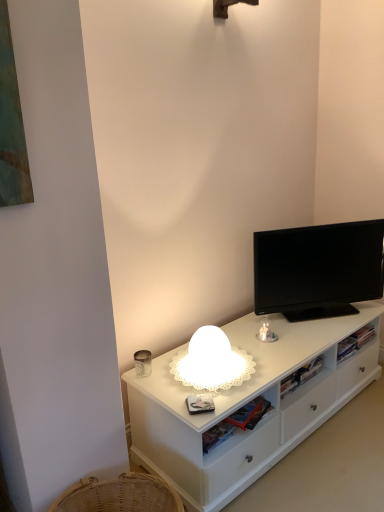
Question: Considering the relative sizes of black glossy tv at upper right and white matte cabinet at center in the image provided, is black glossy tv at upper right wider than white matte cabinet at center?

Choices:
 (A) yes
 (B) no

Answer: (B)

Question: Is black glossy tv at upper right surrounding white matte cabinet at center?

Choices:
 (A) yes
 (B) no

Answer: (B)

Question: Can you confirm if black glossy tv at upper right is positioned to the left of white matte cabinet at center?

Choices:
 (A) no
 (B) yes

Answer: (A)

Question: From the image's perspective, is black glossy tv at upper right over white matte cabinet at center?

Choices:
 (A) yes
 (B) no

Answer: (A)

Question: Does black glossy tv at upper right have a lesser width compared to white matte cabinet at center?

Choices:
 (A) yes
 (B) no

Answer: (A)

Question: Considering the relative positions of black glossy tv at upper right and white matte cabinet at center in the image provided, is black glossy tv at upper right to the left or to the right of white matte cabinet at center?

Choices:
 (A) right
 (B) left

Answer: (A)

Question: Is black glossy tv at upper right spatially inside white matte cabinet at center, or outside of it?

Choices:
 (A) inside
 (B) outside

Answer: (B)

Question: Is point (342, 268) positioned closer to the camera than point (236, 458)?

Choices:
 (A) farther
 (B) closer

Answer: (A)

Question: From a real-world perspective, is black glossy tv at upper right physically located above or below white matte cabinet at center?

Choices:
 (A) below
 (B) above

Answer: (B)

Question: From the image's perspective, relative to white matte cabinet at center, is white frosted glass lamp at center above or below?

Choices:
 (A) below
 (B) above

Answer: (B)

Question: In terms of size, does white frosted glass lamp at center appear bigger or smaller than white matte cabinet at center?

Choices:
 (A) small
 (B) big

Answer: (A)

Question: From their relative heights in the image, would you say white frosted glass lamp at center is taller or shorter than white matte cabinet at center?

Choices:
 (A) tall
 (B) short

Answer: (A)

Question: Is point (215, 379) closer or farther from the camera than point (256, 375)?

Choices:
 (A) farther
 (B) closer

Answer: (B)

Question: Is black glossy tv at upper right wider or thinner than white frosted glass lamp at center?

Choices:
 (A) wide
 (B) thin

Answer: (B)

Question: From the image's perspective, is black glossy tv at upper right positioned above or below white frosted glass lamp at center?

Choices:
 (A) above
 (B) below

Answer: (A)